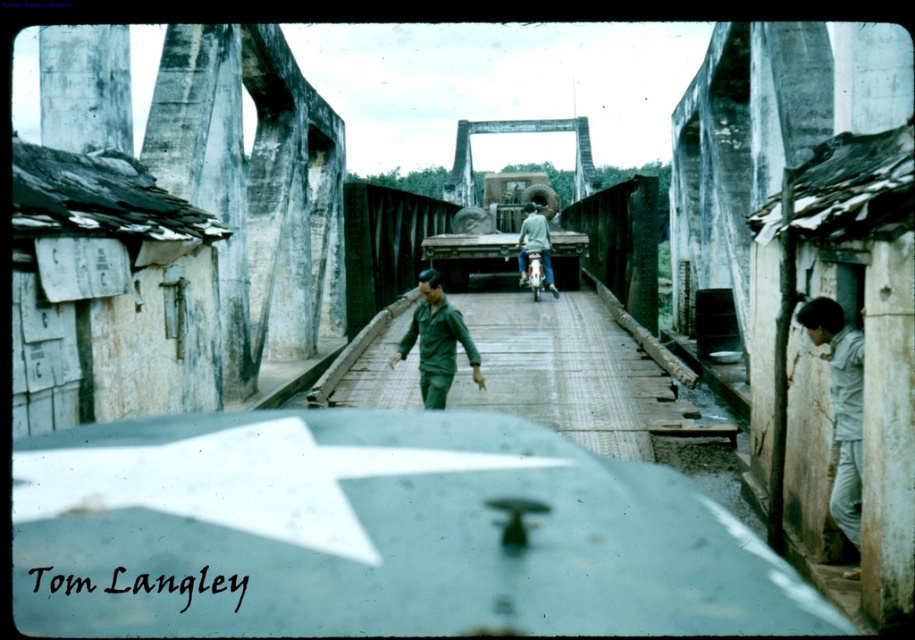
You are inside a military vehicle on the bridge and want to take a photo of two specific points. The first point is at coordinates point (816, 340) and the second is at point (450, 193). Which point will appear larger in your photo?

Point (816, 340) is closer to the camera than point (450, 193), so it will appear larger in the photo.

You are inside a military vehicle and see a person in the foreground. Where is the green fabric man at center located in relation to the vehicle?

The green fabric man at center is located at point (583,380), which is in the foreground relative to the vehicle.